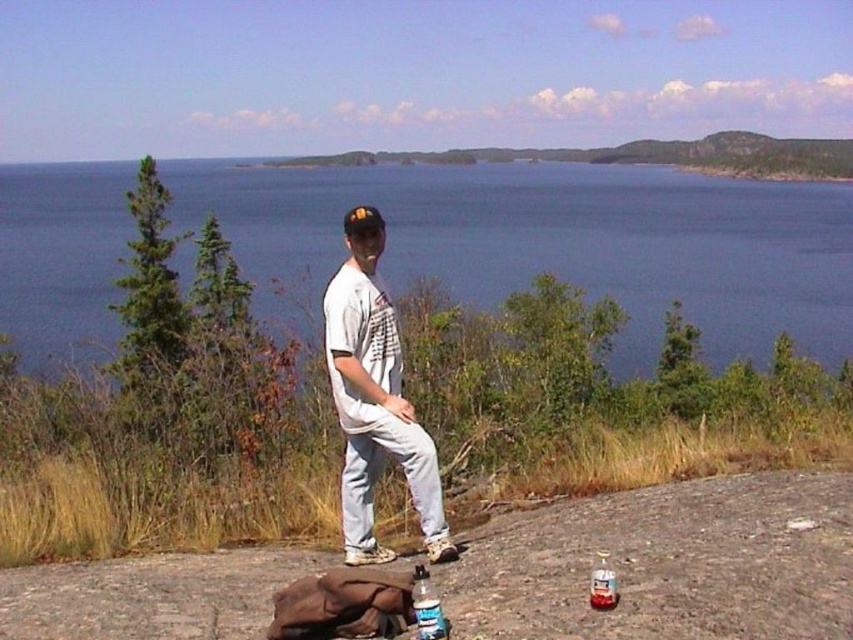
Question: Is blue water at center to the right of translucent plastic bottle at lower center from the viewer's perspective?

Choices:
 (A) yes
 (B) no

Answer: (B)

Question: Which object is closer to the camera taking this photo?

Choices:
 (A) white cotton t-shirt at center
 (B) clear plastic bottle at lower right

Answer: (B)

Question: Among these points, which one is nearest to the camera?

Choices:
 (A) (444, 637)
 (B) (213, 208)
 (C) (341, 355)
 (D) (610, 600)

Answer: (A)

Question: Is white cotton t-shirt at center positioned behind translucent plastic bottle at lower center?

Choices:
 (A) yes
 (B) no

Answer: (A)

Question: Which is farther from the blue water at center?

Choices:
 (A) clear plastic bottle at lower right
 (B) translucent plastic bottle at lower center

Answer: (A)

Question: Is blue water at center above translucent plastic bottle at lower center?

Choices:
 (A) no
 (B) yes

Answer: (B)